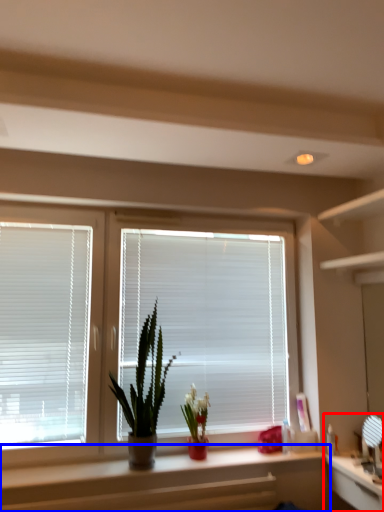
Question: Which point is closer to the camera, computer (highlighted by a red box) or counter (highlighted by a blue box)?

Choices:
 (A) computer
 (B) counter

Answer: (A)